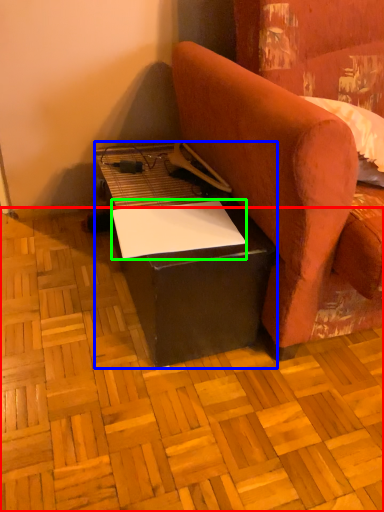
Question: Estimate the real-world distances between objects in this image. Which object is farther from plywood (highlighted by a red box), table (highlighted by a blue box) or notepad (highlighted by a green box)?

Choices:
 (A) table
 (B) notepad

Answer: (B)